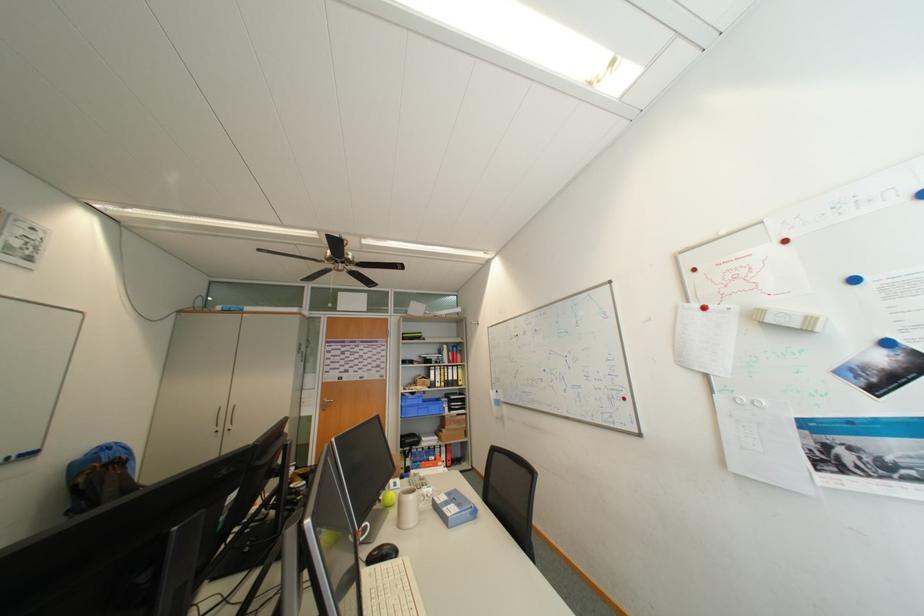
Where would you lift the white round magnet? Please return your answer as a coordinate pair (x, y).

(362, 532)